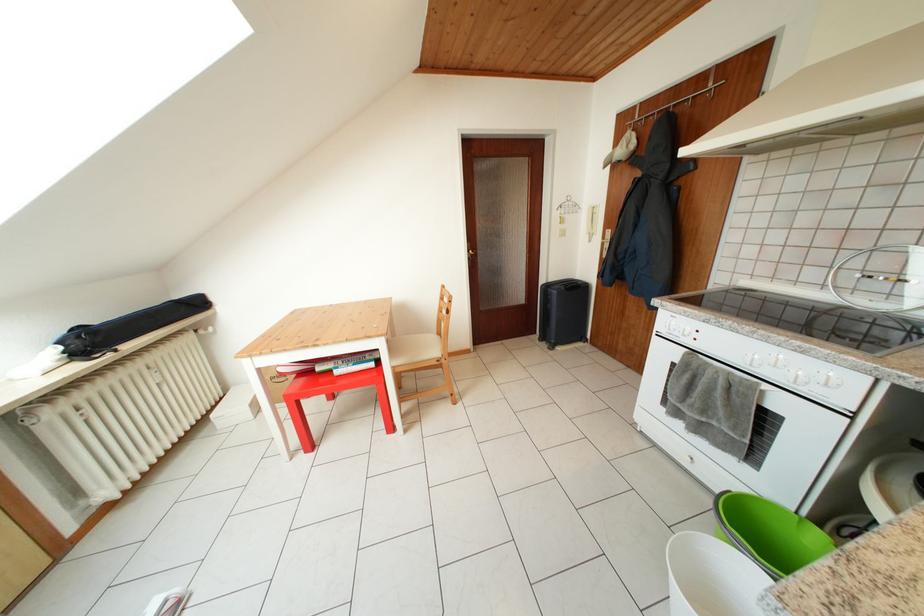
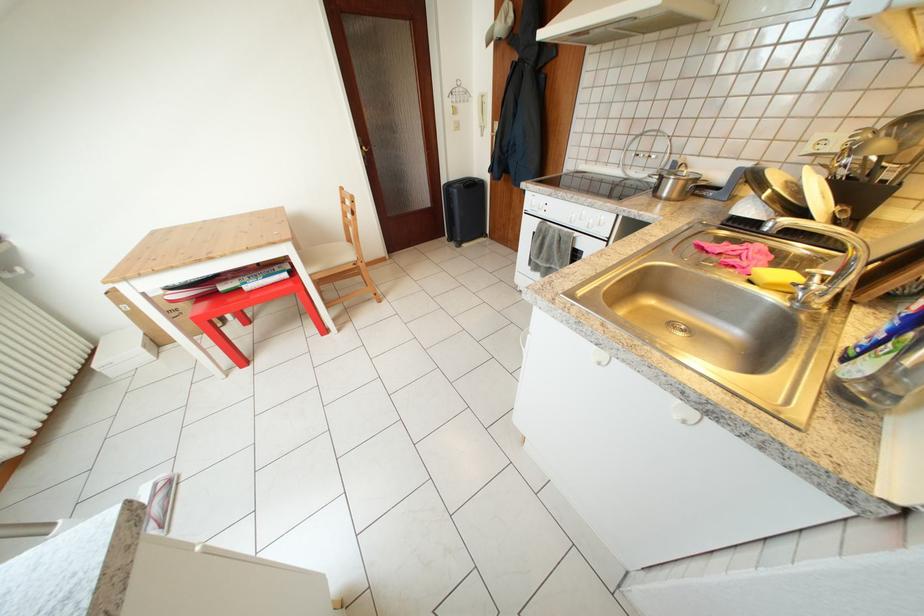
The first image is from the beginning of the video and the second image is from the end. How did the camera likely rotate when shooting the video?

A: The camera rotated toward right-down.